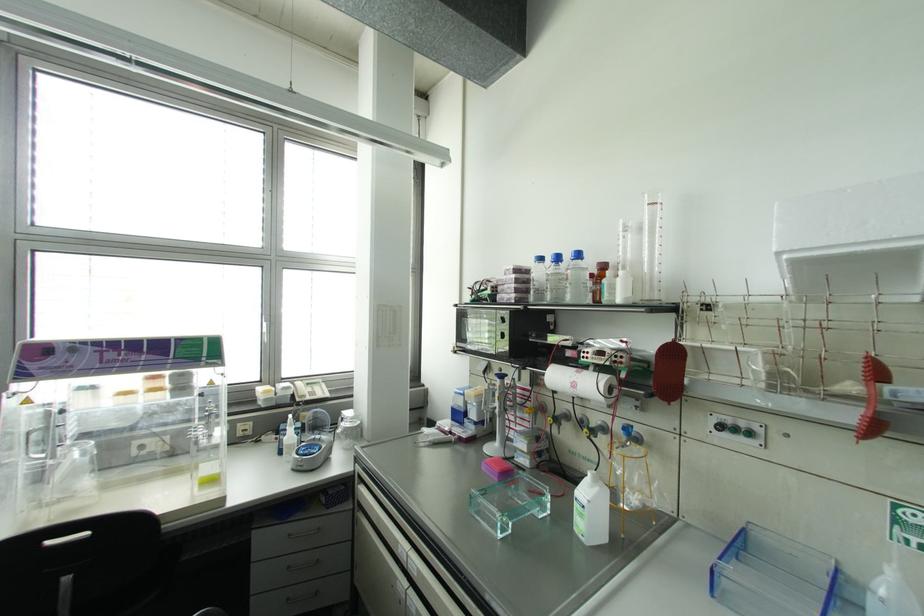
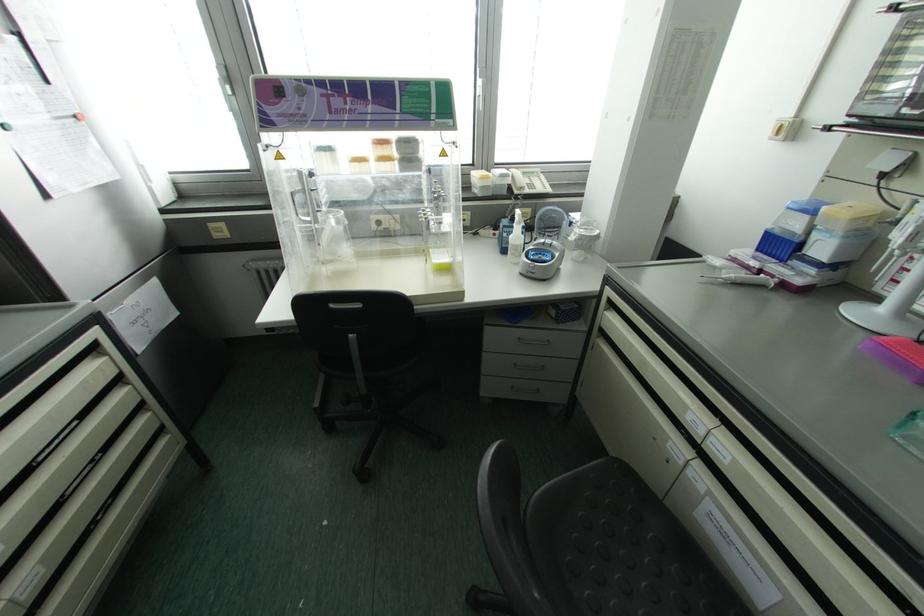
In the second image, find the point that corresponds to (297,399) in the first image.

(515, 191)